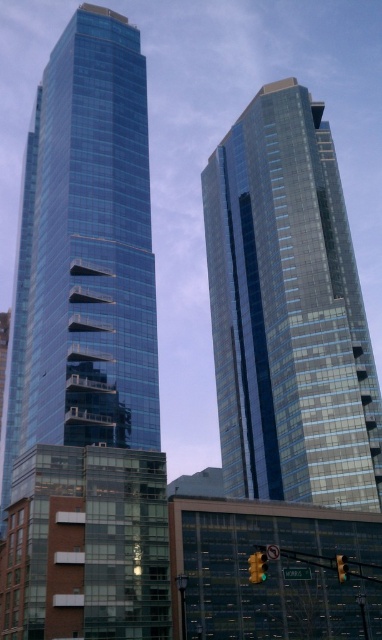
Can you confirm if shiny glass skyscraper at center is wider than yellow glass traffic light at center?

Correct, the width of shiny glass skyscraper at center exceeds that of yellow glass traffic light at center.

Which is below, shiny glass skyscraper at center or yellow glass traffic light at center?

Positioned lower is yellow glass traffic light at center.

Who is more forward, (301,193) or (260,566)?

Point (260,566)

Find the location of a particular element. The image size is (382, 640). shiny glass skyscraper at center is located at coordinates (289, 310).

Between shiny glass skyscraper at center and green glass traffic light at center, which one has more height?

shiny glass skyscraper at center is taller.

Does point (278, 472) lie behind point (341, 560)?

Yes, point (278, 472) is behind point (341, 560).

What do you see at coordinates (289, 310) in the screenshot?
I see `shiny glass skyscraper at center` at bounding box center [289, 310].

The image size is (382, 640). In order to click on shiny glass skyscraper at center in this screenshot , I will do `click(289, 310)`.

Does yellow glass traffic light at center appear on the right side of green glass traffic light at center?

In fact, yellow glass traffic light at center is to the left of green glass traffic light at center.

Can you confirm if yellow glass traffic light at center is positioned below green glass traffic light at center?

Correct, yellow glass traffic light at center is located below green glass traffic light at center.

Identify the location of yellow glass traffic light at center. This screenshot has width=382, height=640. (255, 566).

You are a GUI agent. You are given a task and a screenshot of the screen. Output one action in this format:
    pyautogui.click(x=<x>, y=<y>)
    Task: Click on the yellow glass traffic light at center
    The image size is (382, 640).
    Given the screenshot: What is the action you would take?
    pyautogui.click(x=255, y=566)